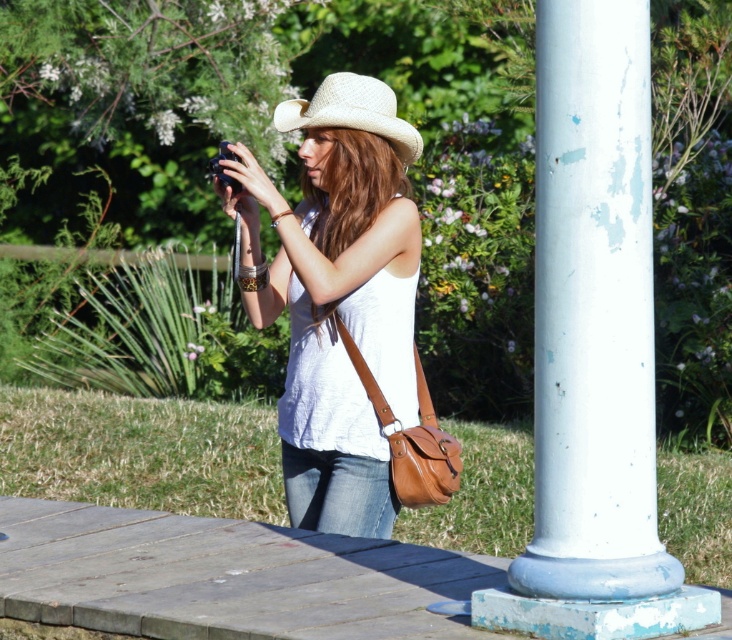
Is white painted metal pole at right positioned behind brown leather shoulder bag at center?

No, white painted metal pole at right is closer to the viewer.

Does white painted metal pole at right appear over brown leather shoulder bag at center?

Indeed, white painted metal pole at right is positioned over brown leather shoulder bag at center.

Is point (635, 232) closer to viewer compared to point (406, 464)?

Yes, point (635, 232) is closer to viewer.

Image resolution: width=732 pixels, height=640 pixels. I want to click on white painted metal pole at right, so click(593, 310).

Is white matte tank top at center below woven straw cowboy hat at center?

Yes, white matte tank top at center is below woven straw cowboy hat at center.

Is white matte tank top at center closer to camera compared to woven straw cowboy hat at center?

Yes, it is.

You are a GUI agent. You are given a task and a screenshot of the screen. Output one action in this format:
    pyautogui.click(x=<x>, y=<y>)
    Task: Click on the white matte tank top at center
    Image resolution: width=732 pixels, height=640 pixels.
    Given the screenshot: What is the action you would take?
    pyautogui.click(x=336, y=296)

Locate an element on the screen. The height and width of the screenshot is (640, 732). white matte tank top at center is located at coordinates (336, 296).

Measure the distance between point (x=643, y=236) and camera.

A distance of 16.63 feet exists between point (x=643, y=236) and camera.

Consider the image. Does white painted metal pole at right appear under woven straw cowboy hat at center?

Yes, white painted metal pole at right is below woven straw cowboy hat at center.

Image resolution: width=732 pixels, height=640 pixels. Describe the element at coordinates (593, 310) in the screenshot. I see `white painted metal pole at right` at that location.

Where is `white painted metal pole at right`? The height and width of the screenshot is (640, 732). white painted metal pole at right is located at coordinates (593, 310).